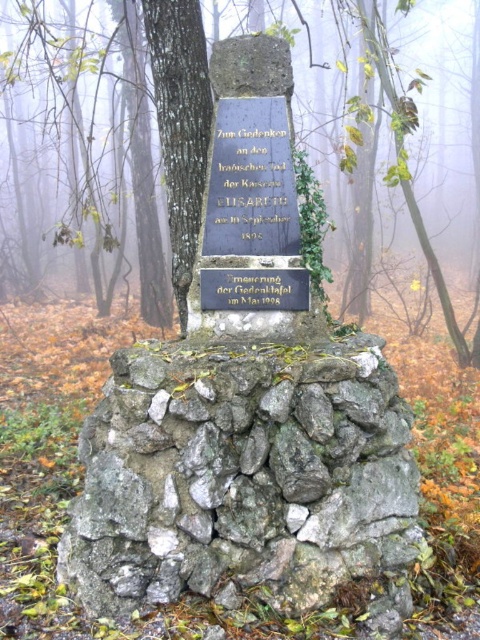
Is dark gray stone monument at center below gray rough stone at center?

Incorrect, dark gray stone monument at center is not positioned below gray rough stone at center.

What do you see at coordinates (247, 410) in the screenshot? Image resolution: width=480 pixels, height=640 pixels. I see `dark gray stone monument at center` at bounding box center [247, 410].

Where is `dark gray stone monument at center`? The height and width of the screenshot is (640, 480). dark gray stone monument at center is located at coordinates (247, 410).

Can you confirm if dark gray stone monument at center is wider than green leafy tree at center?

No, dark gray stone monument at center is not wider than green leafy tree at center.

Does dark gray stone monument at center have a smaller size compared to green leafy tree at center?

Yes.

Is point (382, 412) farther from camera compared to point (37, 17)?

No, (382, 412) is in front of (37, 17).

At what (x,y) coordinates should I click in order to perform the action: click on dark gray stone monument at center. Please return your answer as a coordinate pair (x, y). Looking at the image, I should click on (247, 410).

Which is more to the right, green leafy tree at center or black stone plaque at center?

green leafy tree at center is more to the right.

Between green leafy tree at center and black stone plaque at center, which one appears on the left side from the viewer's perspective?

Positioned to the left is black stone plaque at center.

Is point (189, 156) positioned behind point (280, 177)?

Yes, it is behind point (280, 177).

Locate an element on the screen. This screenshot has width=480, height=640. green leafy tree at center is located at coordinates (32, 97).